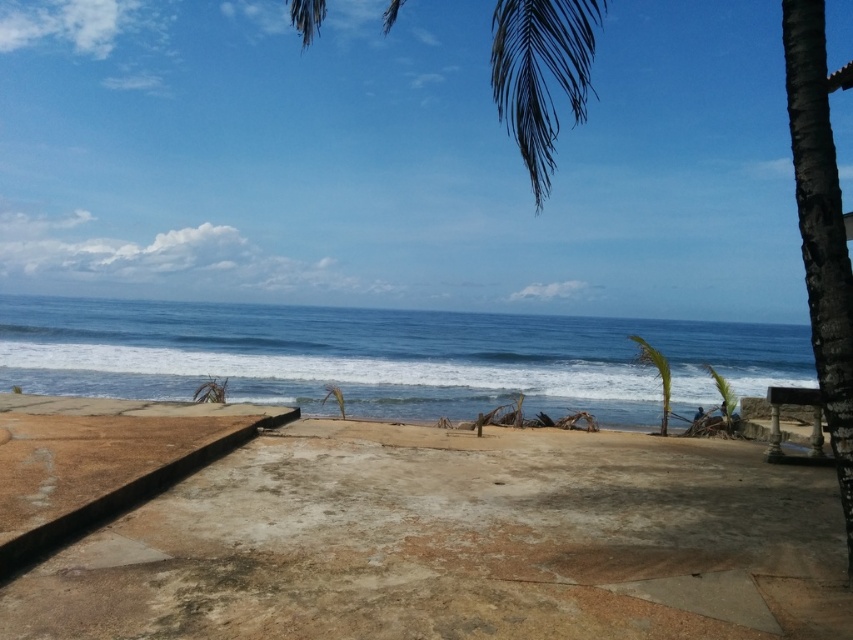
Between green leafy palm tree at upper right and green leafy palm tree at center-right, which one appears on the left side from the viewer's perspective?

green leafy palm tree at upper right is more to the left.

Between point (799, 102) and point (665, 372), which one is positioned in front?

Point (799, 102) is in front.

Who is more distant from viewer, (x=828, y=212) or (x=660, y=365)?

The point (x=660, y=365) is behind.

The image size is (853, 640). I want to click on green leafy palm tree at upper right, so click(x=821, y=230).

Can you confirm if green leafy palm tree at center-right is taller than green leafy palm tree at right?

Incorrect, green leafy palm tree at center-right's height is not larger of green leafy palm tree at right's.

Find the location of a particular element. Image resolution: width=853 pixels, height=640 pixels. green leafy palm tree at center-right is located at coordinates (656, 374).

Is point (166, 636) positioned in front of point (809, 86)?

Yes, it is in front of point (809, 86).

Between brown concrete beach at lower center and green leafy palm tree at upper right, which one has more height?

With more height is green leafy palm tree at upper right.

Where is `brown concrete beach at lower center`? The height and width of the screenshot is (640, 853). brown concrete beach at lower center is located at coordinates (457, 544).

Where is `brown concrete beach at lower center`? brown concrete beach at lower center is located at coordinates (457, 544).